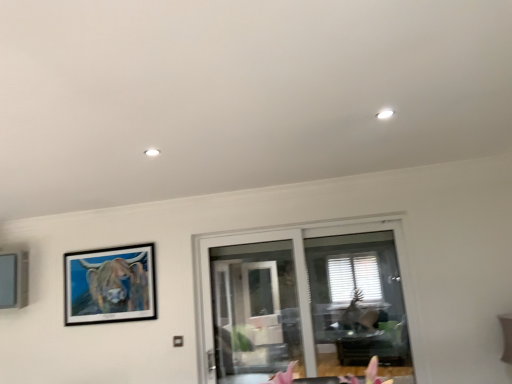
Describe the element at coordinates (306, 302) in the screenshot. This screenshot has height=384, width=512. I see `transparent glass door at center` at that location.

In order to click on wooden-framed painting at upper left, marked as the 1th picture frame in a right-to-left arrangement in this screenshot , I will do `click(110, 285)`.

The image size is (512, 384). What are the coordinates of `transparent glass door at center` in the screenshot? It's located at (306, 302).

From a real-world perspective, is transparent glass door at center positioned over wooden-framed painting at upper left, marked as the 1th picture frame in a right-to-left arrangement, based on gravity?

No, from a real-world perspective, transparent glass door at center is not on top of wooden-framed painting at upper left, marked as the 1th picture frame in a right-to-left arrangement.

Which of these two, transparent glass door at center or wooden-framed painting at upper left, marked as the 1th picture frame in a right-to-left arrangement, stands shorter?

With less height is wooden-framed painting at upper left, marked as the 1th picture frame in a right-to-left arrangement.

Is transparent glass door at center far away from wooden-framed painting at upper left, marked as the 1th picture frame in a right-to-left arrangement?

Yes, transparent glass door at center is far from wooden-framed painting at upper left, marked as the 1th picture frame in a right-to-left arrangement.

Which of these two, transparent glass door at center or wooden-framed painting at upper left, which ranks as the 2th picture frame in left-to-right order, is smaller?

wooden-framed painting at upper left, which ranks as the 2th picture frame in left-to-right order, is smaller.

From the image's perspective, is transparent glass door at center under matte gray picture frame at left, which is the first picture frame in left-to-right order?

Correct, transparent glass door at center appears lower than matte gray picture frame at left, which is the first picture frame in left-to-right order, in the image.

Is transparent glass door at center inside or outside of matte gray picture frame at left, which ranks as the second picture frame in right-to-left order?

transparent glass door at center is not inside matte gray picture frame at left, which ranks as the second picture frame in right-to-left order, it's outside.

How different are the orientations of transparent glass door at center and matte gray picture frame at left, which is the first picture frame in left-to-right order, in degrees?

The angular difference between transparent glass door at center and matte gray picture frame at left, which is the first picture frame in left-to-right order, is 1.65 degrees.

Does transparent glass door at center turn towards matte gray picture frame at left, which ranks as the second picture frame in right-to-left order?

No, transparent glass door at center is not oriented towards matte gray picture frame at left, which ranks as the second picture frame in right-to-left order.

From a real-world perspective, is matte gray picture frame at left, which is the first picture frame in left-to-right order, located higher than wooden-framed painting at upper left, which ranks as the 2th picture frame in left-to-right order?

Yes, from a real-world perspective, matte gray picture frame at left, which is the first picture frame in left-to-right order, is over wooden-framed painting at upper left, which ranks as the 2th picture frame in left-to-right order

Considering the positions of point (13, 254) and point (84, 256), is point (13, 254) closer or farther from the camera than point (84, 256)?

Point (13, 254) appears to be farther away from the viewer than point (84, 256).

Considering the positions of objects matte gray picture frame at left, which ranks as the second picture frame in right-to-left order, and wooden-framed painting at upper left, which ranks as the 2th picture frame in left-to-right order, in the image provided, who is more to the left, matte gray picture frame at left, which ranks as the second picture frame in right-to-left order, or wooden-framed painting at upper left, which ranks as the 2th picture frame in left-to-right order,?

Positioned to the left is matte gray picture frame at left, which ranks as the second picture frame in right-to-left order.

Who is bigger, matte gray picture frame at left, which ranks as the second picture frame in right-to-left order, or wooden-framed painting at upper left, marked as the 1th picture frame in a right-to-left arrangement?

matte gray picture frame at left, which ranks as the second picture frame in right-to-left order, is bigger.

From their relative heights in the image, would you say wooden-framed painting at upper left, marked as the 1th picture frame in a right-to-left arrangement, is taller or shorter than matte gray picture frame at left, which is the first picture frame in left-to-right order?

Clearly, wooden-framed painting at upper left, marked as the 1th picture frame in a right-to-left arrangement, is taller compared to matte gray picture frame at left, which is the first picture frame in left-to-right order.

Looking at the image, does wooden-framed painting at upper left, marked as the 1th picture frame in a right-to-left arrangement, seem bigger or smaller compared to matte gray picture frame at left, which ranks as the second picture frame in right-to-left order?

wooden-framed painting at upper left, marked as the 1th picture frame in a right-to-left arrangement, is smaller than matte gray picture frame at left, which ranks as the second picture frame in right-to-left order.

Does point (92, 309) come farther from viewer compared to point (14, 251)?

No, (92, 309) is in front of (14, 251).

From a real-world perspective, is wooden-framed painting at upper left, which ranks as the 2th picture frame in left-to-right order, on top of matte gray picture frame at left, which is the first picture frame in left-to-right order?

Actually, wooden-framed painting at upper left, which ranks as the 2th picture frame in left-to-right order, is physically below matte gray picture frame at left, which is the first picture frame in left-to-right order, in the real world.

From the image's perspective, which picture frame is the 1st one above the transparent glass door at center? Please provide its 2D coordinates.

[(110, 285)]

From a real-world perspective, is wooden-framed painting at upper left, marked as the 1th picture frame in a right-to-left arrangement, positioned above or below transparent glass door at center?

From a real-world perspective, wooden-framed painting at upper left, marked as the 1th picture frame in a right-to-left arrangement, is physically above transparent glass door at center.

Is wooden-framed painting at upper left, which ranks as the 2th picture frame in left-to-right order, turned away from transparent glass door at center?

No.

Considering the relative sizes of matte gray picture frame at left, which is the first picture frame in left-to-right order, and transparent glass door at center in the image provided, is matte gray picture frame at left, which is the first picture frame in left-to-right order, bigger than transparent glass door at center?

No.

Between matte gray picture frame at left, which is the first picture frame in left-to-right order, and transparent glass door at center, which one has smaller width?

transparent glass door at center.

From their relative heights in the image, would you say matte gray picture frame at left, which ranks as the second picture frame in right-to-left order, is taller or shorter than transparent glass door at center?

In the image, matte gray picture frame at left, which ranks as the second picture frame in right-to-left order, appears to be shorter than transparent glass door at center.

From the image's perspective, starting from the transparent glass door at center, which picture frame is the 2nd one above? Please provide its 2D coordinates.

[(14, 279)]

Find the location of a particular element. The image size is (512, 384). window beneath the wooden-framed painting at upper left, which ranks as the 2th picture frame in left-to-right order (from a real-world perspective) is located at coordinates (306, 302).

Find the location of a particular element. This screenshot has height=384, width=512. window below the matte gray picture frame at left, which ranks as the second picture frame in right-to-left order (from the image's perspective) is located at coordinates (306, 302).

When comparing their distances from wooden-framed painting at upper left, which ranks as the 2th picture frame in left-to-right order, does transparent glass door at center or matte gray picture frame at left, which is the first picture frame in left-to-right order, seem closer?

matte gray picture frame at left, which is the first picture frame in left-to-right order, is closer to wooden-framed painting at upper left, which ranks as the 2th picture frame in left-to-right order.

When comparing their distances from wooden-framed painting at upper left, marked as the 1th picture frame in a right-to-left arrangement, does matte gray picture frame at left, which is the first picture frame in left-to-right order, or transparent glass door at center seem further?

transparent glass door at center is positioned further to the anchor wooden-framed painting at upper left, marked as the 1th picture frame in a right-to-left arrangement.

From the image, which object appears to be nearer to transparent glass door at center, matte gray picture frame at left, which is the first picture frame in left-to-right order, or wooden-framed painting at upper left, which ranks as the 2th picture frame in left-to-right order?

Based on the image, wooden-framed painting at upper left, which ranks as the 2th picture frame in left-to-right order, appears to be nearer to transparent glass door at center.

When comparing their distances from matte gray picture frame at left, which is the first picture frame in left-to-right order, does wooden-framed painting at upper left, marked as the 1th picture frame in a right-to-left arrangement, or transparent glass door at center seem further?

transparent glass door at center.

Looking at the image, which one is located closer to matte gray picture frame at left, which ranks as the second picture frame in right-to-left order, transparent glass door at center or wooden-framed painting at upper left, which ranks as the 2th picture frame in left-to-right order?

The object closer to matte gray picture frame at left, which ranks as the second picture frame in right-to-left order, is wooden-framed painting at upper left, which ranks as the 2th picture frame in left-to-right order.

Considering their positions, is wooden-framed painting at upper left, which ranks as the 2th picture frame in left-to-right order, positioned closer to transparent glass door at center than matte gray picture frame at left, which is the first picture frame in left-to-right order?

Based on the image, wooden-framed painting at upper left, which ranks as the 2th picture frame in left-to-right order, appears to be nearer to transparent glass door at center.

Identify the location of picture frame between matte gray picture frame at left, which ranks as the second picture frame in right-to-left order, and transparent glass door at center, in the horizontal direction. (110, 285).